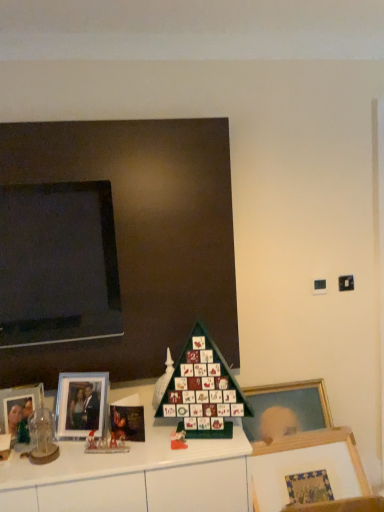
The width and height of the screenshot is (384, 512). In order to click on free location in front of matte glass picture frame at left, acting as the 3th picture frame starting from the right in this screenshot , I will do `click(20, 464)`.